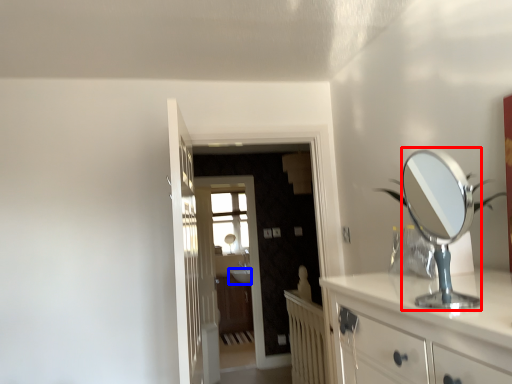
Question: Which of the following is the farthest to the observer, mirror (highlighted by a red box) or sink (highlighted by a blue box)?

Choices:
 (A) mirror
 (B) sink

Answer: (B)